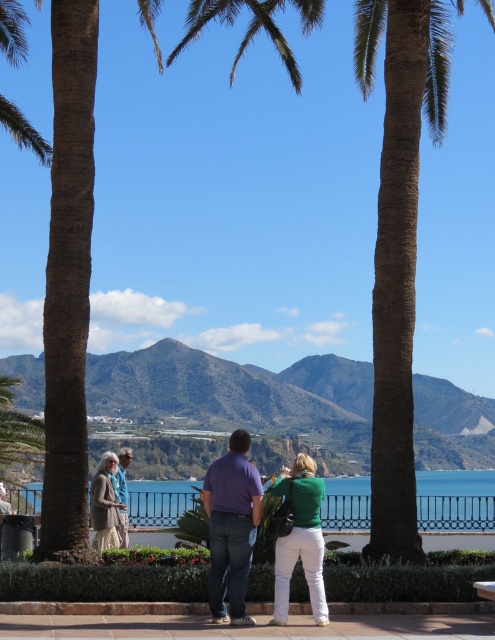
You are standing at the center of the walkway and want to look at the blue water at center. According to the coordinates, where should you look?

The blue water at center is located at coordinates point [455,500], so you should look towards that coordinate point to see it.